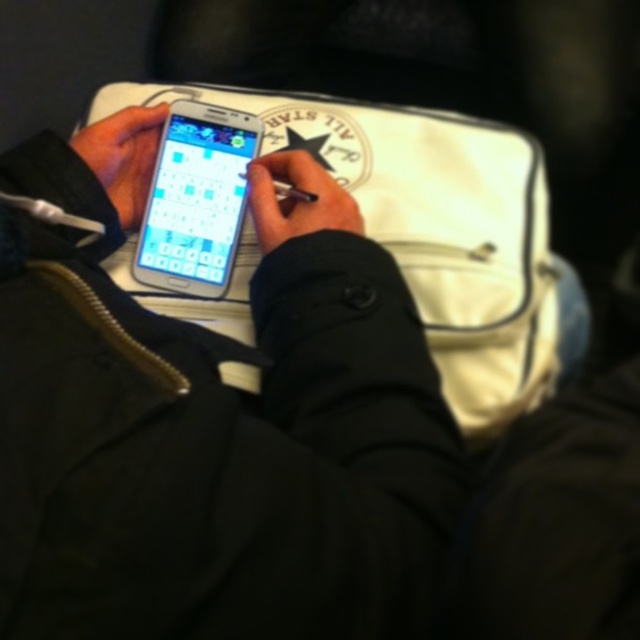
You are a delivery person who needs to place a small package on the counter. The counter has a white fabric bag at center. Where should you place the package so it doesn not cover the bag?

The white fabric bag at center is located at point [432,228]. To avoid covering it, place the package away from that coordinate.

You are a photographer trying to capture a closeup of the black matte phone at center. The optimal focus distance for your lens is 25 centimeters. Can you adjust your position to ensure the phone is in focus without moving the phone itself?

The black matte phone at center is currently 26.47 centimeters away from the camera. Since the optimal focus distance is 25 centimeters, you need to move the camera closer by approximately 1.47 centimeters to achieve proper focus without moving the phone itself.

You are organizing items on a shelf and need to place both the white fabric bag at center and the matte black smartphone at center. If you want to arrange them vertically so that the taller item is above the shorter one, which item should be placed on top?

The white fabric bag at center is taller than the matte black smartphone at center, so it should be placed on top to follow the vertical arrangement requirement.